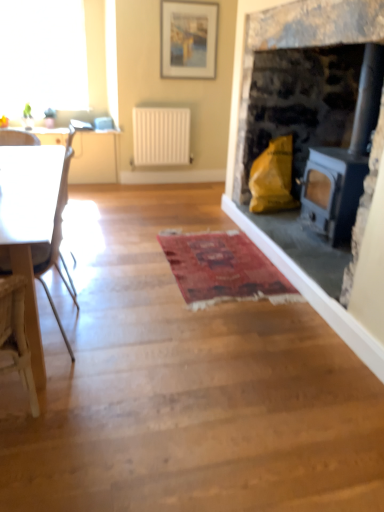
Locate an element on the screen. The width and height of the screenshot is (384, 512). vacant space to the right of white plastic chair at left is located at coordinates (132, 334).